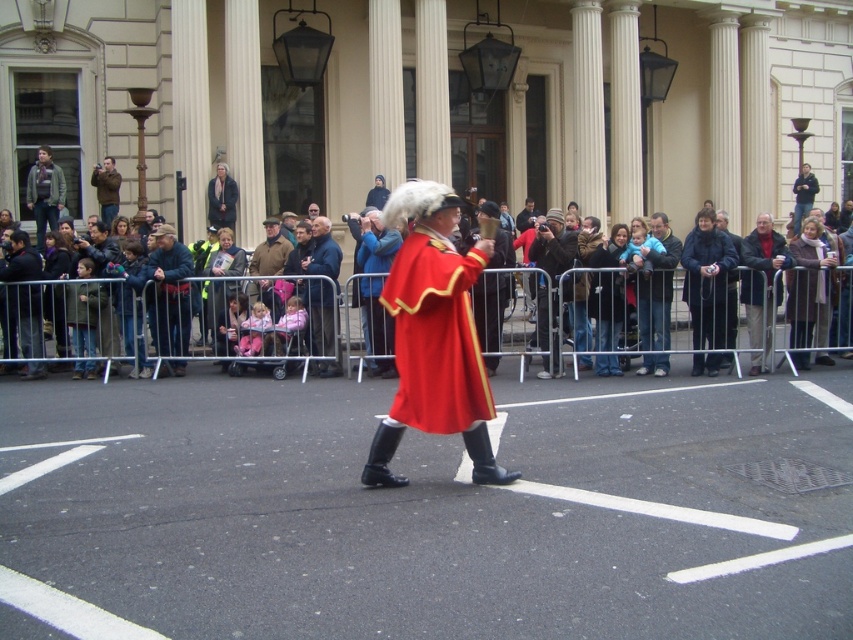
You are a photographer standing at the edge of the street, and you want to take a photo of the matte red coat at center and the brown leather jacket at upper center. The minimum distance required for your camera to focus on both subjects clearly is 40 feet. Can you capture both subjects in focus without moving your position?

The matte red coat at center is 42.58 feet from the brown leather jacket at upper center. Since the minimum focus distance required is 40 feet and the distance between them is 42.58 feet, the camera can focus on both subjects clearly without moving your position.

You are a photographer trying to capture a clear shot of the matte red coat at center and the brown leather jacket at upper center. Which object is closer to the camera based on their positions?

The matte red coat at center is positioned under the brown leather jacket at upper center, meaning the brown leather jacket at upper center is closer to the camera.

You are a photographer trying to capture a photo of both the matte red coat at center and the brown leather jacket at upper center. Based on their sizes, which one should you zoom in on more to ensure both are clearly visible in the frame?

The matte red coat at center is smaller than the brown leather jacket at upper center. To ensure both are clearly visible, you should zoom in slightly more on the matte red coat at center to balance their sizes in the photo.